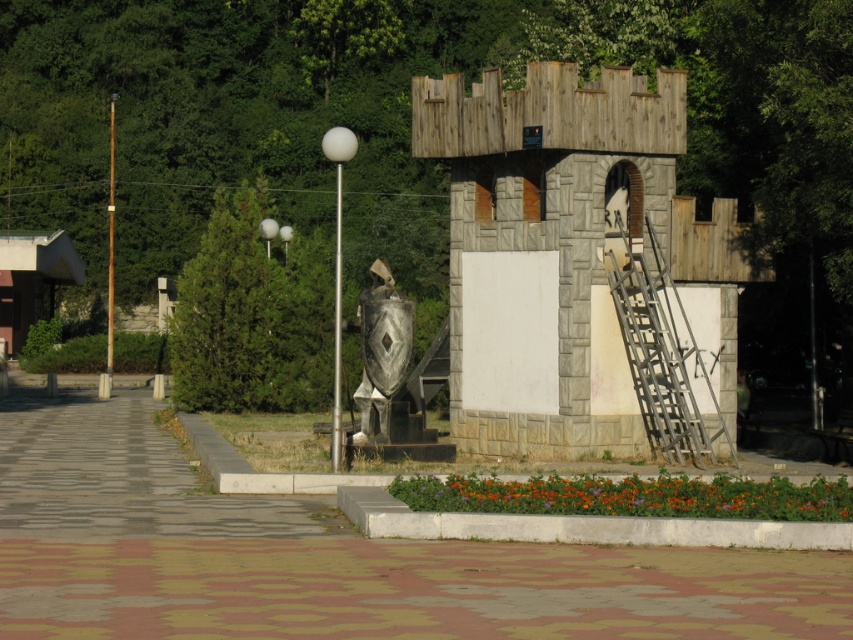
You are standing in front of the miniature castle structure and want to place a small flag at the point closer to you between point [672,374] and point [372,284]. Which point should you choose?

You should choose point [672,374] because it is closer to you than point [372,284].

You are standing near the metallic silver shield at center and want to reach the top of the metallic silver ladder at right. Is the ladder accessible from your current position?

The metallic silver ladder at right is located above the metallic silver shield at center, so you can access the ladder by moving to its base and climbing up since it is positioned above the shield.

You are a painter who needs to paint both the metallic silver ladder at right and the metallic silver shield at center. Since you have limited paint, which object will require more paint and why?

The metallic silver ladder at right requires more paint because it is larger in size than the metallic silver shield at center.